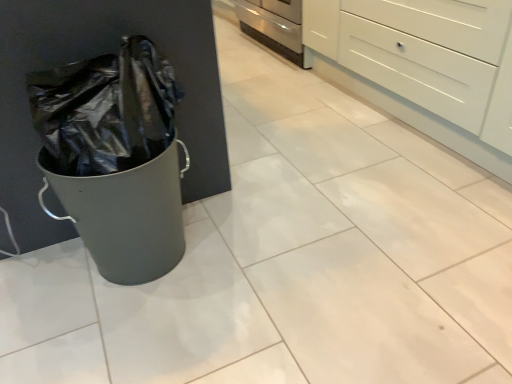
Question: Does point (283, 46) appear closer or farther from the camera than point (321, 18)?

Choices:
 (A) closer
 (B) farther

Answer: (B)

Question: From the image's perspective, is stainless steel oven at center positioned above or below white glossy chest of drawers at upper right?

Choices:
 (A) above
 (B) below

Answer: (A)

Question: In the image, is stainless steel oven at center on the left side or the right side of white glossy chest of drawers at upper right?

Choices:
 (A) right
 (B) left

Answer: (B)

Question: Do you think white glossy chest of drawers at upper right is within stainless steel oven at center, or outside of it?

Choices:
 (A) outside
 (B) inside

Answer: (A)

Question: Considering the positions of point [x=480, y=104] and point [x=244, y=14], is point [x=480, y=104] closer or farther from the camera than point [x=244, y=14]?

Choices:
 (A) farther
 (B) closer

Answer: (B)

Question: From a real-world perspective, is white glossy chest of drawers at upper right physically located above or below stainless steel oven at center?

Choices:
 (A) above
 (B) below

Answer: (A)

Question: Visually, is white glossy chest of drawers at upper right positioned to the left or to the right of stainless steel oven at center?

Choices:
 (A) left
 (B) right

Answer: (B)